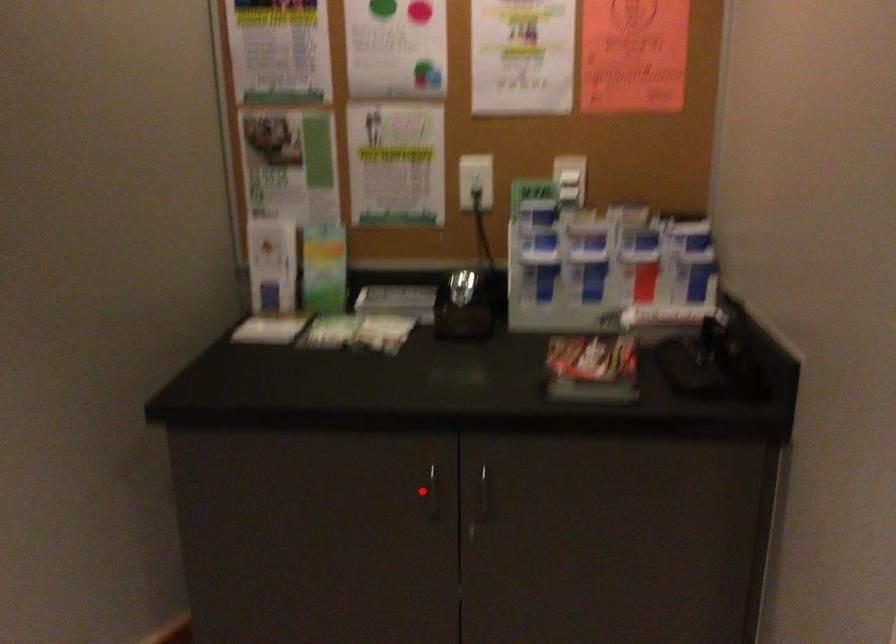
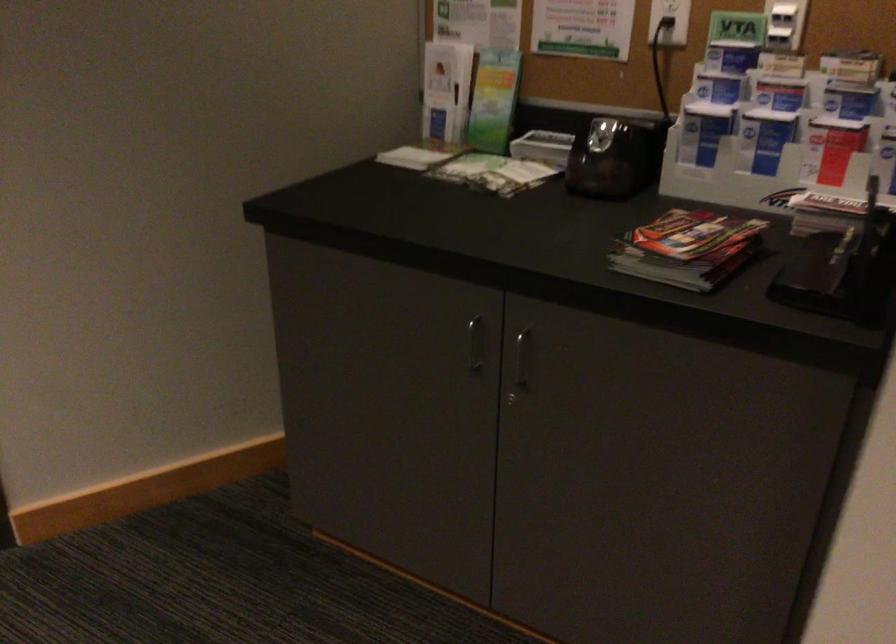
Locate, in the second image, the point that corresponds to the highlighted location in the first image.

(475, 343)